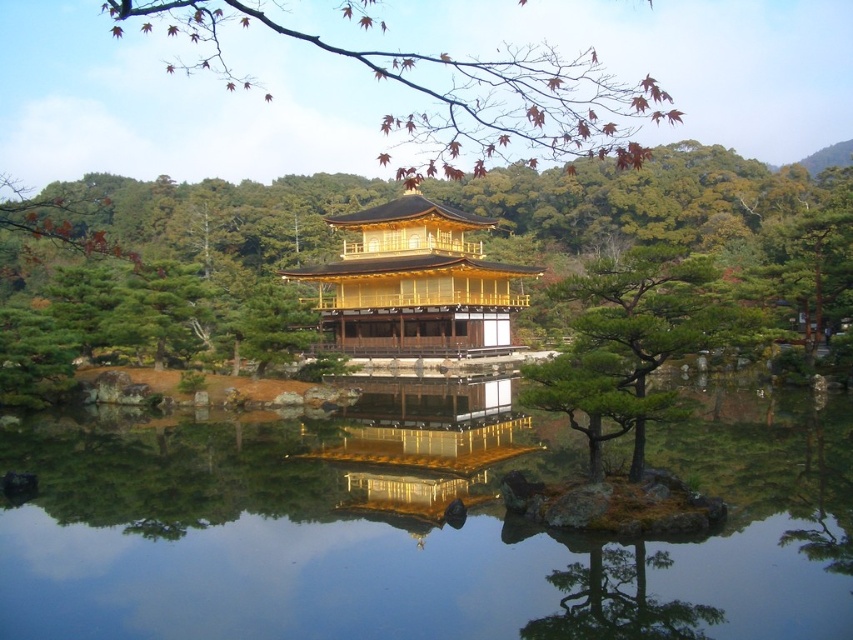
Question: Does green textured pine tree at center appear on the left side of green textured tree at center?

Choices:
 (A) no
 (B) yes

Answer: (B)

Question: Is reddish-brown bark branch at upper center wider than gold polished wood palace at center?

Choices:
 (A) yes
 (B) no

Answer: (A)

Question: Which object is the closest to the green textured pine tree at center?

Choices:
 (A) gold polished wood palace at center
 (B) green textured tree at center
 (C) reddish-brown bark branch at upper center

Answer: (A)

Question: Can you confirm if transparent water at center is positioned above green textured pine tree at center?

Choices:
 (A) yes
 (B) no

Answer: (B)

Question: Which of the following is the farthest from the observer?

Choices:
 (A) (467, 84)
 (B) (183, 476)
 (C) (416, 225)

Answer: (A)

Question: Based on their relative distances, which object is farther from the gold polished wood palace at center?

Choices:
 (A) green textured tree at center
 (B) transparent water at center

Answer: (B)